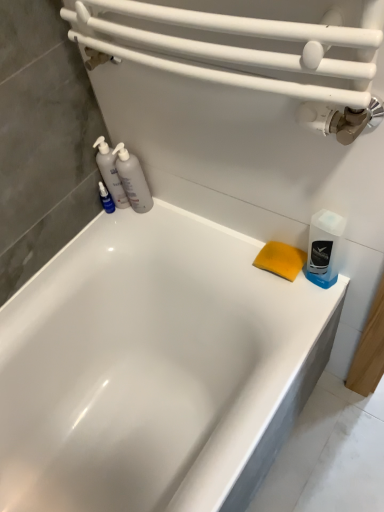
I want to click on translucent plastic bottles at left, the second cleaning product in the right-to-left sequence, so click(132, 180).

Describe the element at coordinates (110, 172) in the screenshot. I see `translucent plastic bottles at left, placed as the 1th cleaning product when sorted from left to right` at that location.

What do you see at coordinates (154, 367) in the screenshot? Image resolution: width=384 pixels, height=512 pixels. I see `white glossy bathtub at center` at bounding box center [154, 367].

I want to click on blue translucent bottle at right, which is the first cleaning product in right-to-left order, so click(324, 248).

Does translucent plastic bottles at left, the second cleaning product in the right-to-left sequence, touch translucent plastic bottles at left, which ranks as the third cleaning product in right-to-left order?

Yes, translucent plastic bottles at left, the second cleaning product in the right-to-left sequence, is right next to translucent plastic bottles at left, which ranks as the third cleaning product in right-to-left order, and making contact.

Is translucent plastic bottles at left, marked as the second cleaning product in a left-to-right arrangement, oriented towards translucent plastic bottles at left, which ranks as the third cleaning product in right-to-left order?

No, translucent plastic bottles at left, marked as the second cleaning product in a left-to-right arrangement, does not turn towards translucent plastic bottles at left, which ranks as the third cleaning product in right-to-left order.

From a real-world perspective, which object rests below the other?

translucent plastic bottles at left, which ranks as the third cleaning product in right-to-left order.

Is translucent plastic bottles at left, which ranks as the third cleaning product in right-to-left order, completely or partially inside translucent plastic bottles at left, the second cleaning product in the right-to-left sequence?

Definitely not — translucent plastic bottles at left, which ranks as the third cleaning product in right-to-left order, is not inside translucent plastic bottles at left, the second cleaning product in the right-to-left sequence.

From the image's perspective, between translucent plastic bottles at left, marked as the second cleaning product in a left-to-right arrangement, and white glossy bathtub at center, who is located below?

white glossy bathtub at center is shown below in the image.

Between translucent plastic bottles at left, the second cleaning product in the right-to-left sequence, and white glossy bathtub at center, which one has smaller size?

translucent plastic bottles at left, the second cleaning product in the right-to-left sequence.

From a real-world perspective, which object stands above the other?

translucent plastic bottles at left, marked as the second cleaning product in a left-to-right arrangement.

This screenshot has width=384, height=512. I want to click on cleaning product lying on the right of white glossy bathtub at center, so click(324, 248).

Would you say white glossy bathtub at center is outside blue translucent bottle at right, which is the first cleaning product in right-to-left order?

Absolutely, white glossy bathtub at center is external to blue translucent bottle at right, which is the first cleaning product in right-to-left order.

Which object is closer to the camera, white glossy bathtub at center or blue translucent bottle at right, which is the first cleaning product in right-to-left order?

white glossy bathtub at center is in front.

From the image's perspective, is white glossy bathtub at center located above or below blue translucent bottle at right, which is counted as the third cleaning product, starting from the left?

white glossy bathtub at center is below blue translucent bottle at right, which is counted as the third cleaning product, starting from the left.

You are a GUI agent. You are given a task and a screenshot of the screen. Output one action in this format:
    pyautogui.click(x=<x>, y=<y>)
    Task: Click on the cleaning product that is the 2nd object to the left of the white glossy bathtub at center, starting at the anchor
    The image size is (384, 512).
    Given the screenshot: What is the action you would take?
    pyautogui.click(x=110, y=172)

Can you confirm if white glossy bathtub at center is wider than translucent plastic bottles at left, which ranks as the third cleaning product in right-to-left order?

Yes.

Is white glossy bathtub at center facing towards translucent plastic bottles at left, which ranks as the third cleaning product in right-to-left order?

No, white glossy bathtub at center is not facing towards translucent plastic bottles at left, which ranks as the third cleaning product in right-to-left order.

From the picture: Is white glossy bathtub at center to the left or to the right of translucent plastic bottles at left, placed as the 1th cleaning product when sorted from left to right, in the image?

In the image, white glossy bathtub at center appears on the right side of translucent plastic bottles at left, placed as the 1th cleaning product when sorted from left to right.

Are blue translucent bottle at left and blue translucent bottle at right, which is counted as the third cleaning product, starting from the left, beside each other?

No, blue translucent bottle at left is not with blue translucent bottle at right, which is counted as the third cleaning product, starting from the left.

Is blue translucent bottle at left bigger than blue translucent bottle at right, which is the first cleaning product in right-to-left order?

Incorrect, blue translucent bottle at left is not larger than blue translucent bottle at right, which is the first cleaning product in right-to-left order.

Would you say blue translucent bottle at left is outside blue translucent bottle at right, which is counted as the third cleaning product, starting from the left?

Yes, blue translucent bottle at left is located beyond the bounds of blue translucent bottle at right, which is counted as the third cleaning product, starting from the left.

From the blue translucent bottle at right, which is counted as the third cleaning product, starting from the left, count the 2nd cleaning product to the left and point to it. Please provide its 2D coordinates.

[(110, 172)]

Which is in front, point (115, 176) or point (338, 221)?

The point (338, 221) is in front.

Could you tell me if translucent plastic bottles at left, which ranks as the third cleaning product in right-to-left order, is facing blue translucent bottle at right, which is counted as the third cleaning product, starting from the left?

No.

Can you tell me how much translucent plastic bottles at left, placed as the 1th cleaning product when sorted from left to right, and blue translucent bottle at right, which is counted as the third cleaning product, starting from the left, differ in facing direction?

translucent plastic bottles at left, placed as the 1th cleaning product when sorted from left to right, and blue translucent bottle at right, which is counted as the third cleaning product, starting from the left, are facing 3.04 degrees away from each other.

Is translucent plastic bottles at left, the second cleaning product in the right-to-left sequence, with blue translucent bottle at right, which is counted as the third cleaning product, starting from the left?

No, translucent plastic bottles at left, the second cleaning product in the right-to-left sequence, is not making contact with blue translucent bottle at right, which is counted as the third cleaning product, starting from the left.

Does translucent plastic bottles at left, the second cleaning product in the right-to-left sequence, turn towards blue translucent bottle at right, which is the first cleaning product in right-to-left order?

No, translucent plastic bottles at left, the second cleaning product in the right-to-left sequence, is not oriented towards blue translucent bottle at right, which is the first cleaning product in right-to-left order.

Can you confirm if translucent plastic bottles at left, marked as the second cleaning product in a left-to-right arrangement, is wider than blue translucent bottle at right, which is the first cleaning product in right-to-left order?

Yes.

How much distance is there between translucent plastic bottles at left, the second cleaning product in the right-to-left sequence, and blue translucent bottle at right, which is the first cleaning product in right-to-left order?

translucent plastic bottles at left, the second cleaning product in the right-to-left sequence, and blue translucent bottle at right, which is the first cleaning product in right-to-left order, are 51.66 centimeters apart from each other.

Where is `the 1st cleaning product in front of the translucent plastic bottles at left, placed as the 1th cleaning product when sorted from left to right`? The height and width of the screenshot is (512, 384). the 1st cleaning product in front of the translucent plastic bottles at left, placed as the 1th cleaning product when sorted from left to right is located at coordinates (132, 180).

Locate an element on the screen. The image size is (384, 512). bathtub below the translucent plastic bottles at left, marked as the second cleaning product in a left-to-right arrangement (from a real-world perspective) is located at coordinates (154, 367).

Which object lies further to the anchor point white glossy bathtub at center, translucent plastic bottles at left, marked as the second cleaning product in a left-to-right arrangement, or blue translucent bottle at left?

blue translucent bottle at left lies further to white glossy bathtub at center than the other object.

Looking at the image, which one is located closer to white glossy bathtub at center, blue translucent bottle at right, which is counted as the third cleaning product, starting from the left, or blue translucent bottle at left?

blue translucent bottle at right, which is counted as the third cleaning product, starting from the left, is closer to white glossy bathtub at center.

From the image, which object appears to be farther from translucent plastic bottles at left, the second cleaning product in the right-to-left sequence, translucent plastic bottles at left, which ranks as the third cleaning product in right-to-left order, or blue translucent bottle at left?

Based on the image, blue translucent bottle at left appears to be further to translucent plastic bottles at left, the second cleaning product in the right-to-left sequence.

From the image, which object appears to be farther from translucent plastic bottles at left, which ranks as the third cleaning product in right-to-left order, blue translucent bottle at left or blue translucent bottle at right, which is the first cleaning product in right-to-left order?

Among the two, blue translucent bottle at right, which is the first cleaning product in right-to-left order, is located further to translucent plastic bottles at left, which ranks as the third cleaning product in right-to-left order.

Looking at the image, which one is located further to blue translucent bottle at right, which is counted as the third cleaning product, starting from the left, white glossy bathtub at center or translucent plastic bottles at left, marked as the second cleaning product in a left-to-right arrangement?

translucent plastic bottles at left, marked as the second cleaning product in a left-to-right arrangement, is further to blue translucent bottle at right, which is counted as the third cleaning product, starting from the left.

Which object lies further to the anchor point blue translucent bottle at left, translucent plastic bottles at left, which ranks as the third cleaning product in right-to-left order, or translucent plastic bottles at left, the second cleaning product in the right-to-left sequence?

translucent plastic bottles at left, the second cleaning product in the right-to-left sequence, lies further to blue translucent bottle at left than the other object.

Estimate the real-world distances between objects in this image. Which object is closer to white glossy bathtub at center, translucent plastic bottles at left, marked as the second cleaning product in a left-to-right arrangement, or blue translucent bottle at right, which is counted as the third cleaning product, starting from the left?

The object closer to white glossy bathtub at center is translucent plastic bottles at left, marked as the second cleaning product in a left-to-right arrangement.

Considering their positions, is blue translucent bottle at right, which is the first cleaning product in right-to-left order, positioned closer to blue translucent bottle at left than white glossy bathtub at center?

white glossy bathtub at center is positioned closer to the anchor blue translucent bottle at left.

Find the location of `cleaning product located between translucent plastic bottles at left, the second cleaning product in the right-to-left sequence, and blue translucent bottle at left in the depth direction`. cleaning product located between translucent plastic bottles at left, the second cleaning product in the right-to-left sequence, and blue translucent bottle at left in the depth direction is located at coordinates (110, 172).

The height and width of the screenshot is (512, 384). Identify the location of toiletry between translucent plastic bottles at left, which ranks as the third cleaning product in right-to-left order, and white glossy bathtub at center from top to bottom. (106, 199).

You are a GUI agent. You are given a task and a screenshot of the screen. Output one action in this format:
    pyautogui.click(x=<x>, y=<y>)
    Task: Click on the cleaning product between blue translucent bottle at left and white glossy bathtub at center from top to bottom
    Image resolution: width=384 pixels, height=512 pixels.
    Given the screenshot: What is the action you would take?
    pyautogui.click(x=324, y=248)

Find the location of `cleaning product situated between translucent plastic bottles at left, which ranks as the third cleaning product in right-to-left order, and blue translucent bottle at right, which is counted as the third cleaning product, starting from the left, from left to right`. cleaning product situated between translucent plastic bottles at left, which ranks as the third cleaning product in right-to-left order, and blue translucent bottle at right, which is counted as the third cleaning product, starting from the left, from left to right is located at coordinates (132, 180).